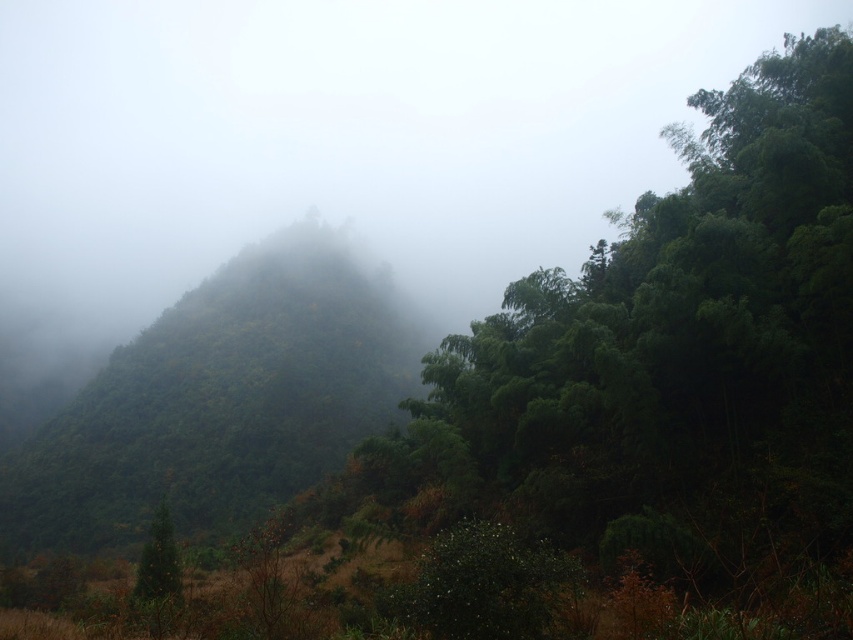
Question: Is green matte forest at center below green matte tree at lower left?

Choices:
 (A) yes
 (B) no

Answer: (B)

Question: Which of the following is the farthest from the observer?

Choices:
 (A) (263, 403)
 (B) (171, 602)

Answer: (A)

Question: Is green matte forest at center to the left of green matte tree at lower left from the viewer's perspective?

Choices:
 (A) yes
 (B) no

Answer: (A)

Question: Which of the following is the closest to the observer?

Choices:
 (A) (264, 412)
 (B) (173, 552)

Answer: (B)

Question: Among these points, which one is nearest to the camera?

Choices:
 (A) (154, 605)
 (B) (244, 301)

Answer: (A)

Question: Does green matte forest at center have a smaller size compared to green matte tree at lower left?

Choices:
 (A) no
 (B) yes

Answer: (A)